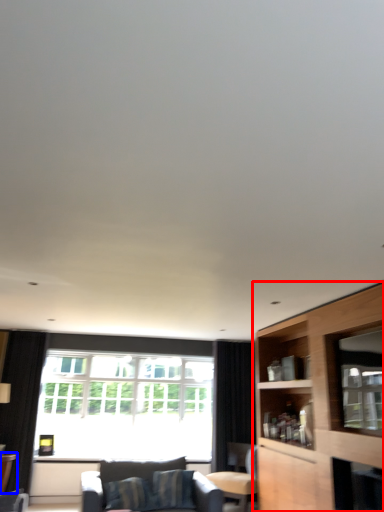
Question: Which object is further to the camera taking this photo, cabinetry (highlighted by a red box) or table (highlighted by a blue box)?

Choices:
 (A) cabinetry
 (B) table

Answer: (B)